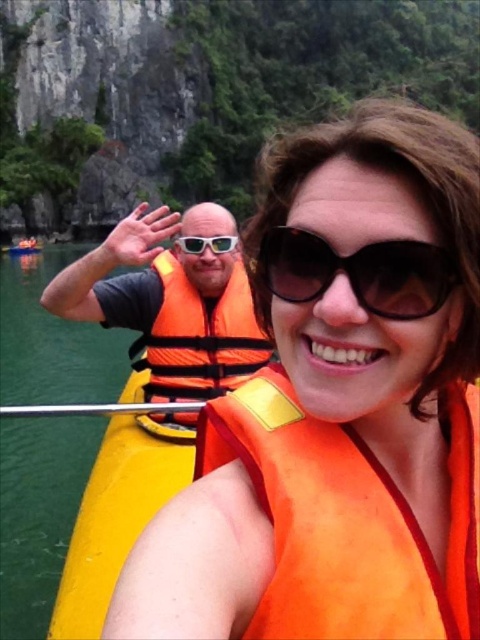
Is black plastic sunglasses at center thinner than white plastic goggles at center?

In fact, black plastic sunglasses at center might be wider than white plastic goggles at center.

Which is more to the right, black plastic sunglasses at center or white plastic goggles at center?

black plastic sunglasses at center is more to the right.

Image resolution: width=480 pixels, height=640 pixels. What do you see at coordinates (358, 273) in the screenshot?
I see `black plastic sunglasses at center` at bounding box center [358, 273].

Where is `black plastic sunglasses at center`? black plastic sunglasses at center is located at coordinates (358, 273).

Identify the location of orange fabric life jacket at left. (200, 337).

Between point (143, 358) and point (81, 413), which one is positioned in front?

Point (81, 413)

Where is `orange fabric life jacket at left`? The image size is (480, 640). orange fabric life jacket at left is located at coordinates (200, 337).

Is orange life vest at center to the left of yellow plastic paddle at center from the viewer's perspective?

Incorrect, orange life vest at center is not on the left side of yellow plastic paddle at center.

This screenshot has height=640, width=480. What are the coordinates of `orange life vest at center` in the screenshot? It's located at (335, 404).

This screenshot has height=640, width=480. Describe the element at coordinates (335, 404) in the screenshot. I see `orange life vest at center` at that location.

Where is `orange life vest at center`? orange life vest at center is located at coordinates pyautogui.click(x=335, y=404).